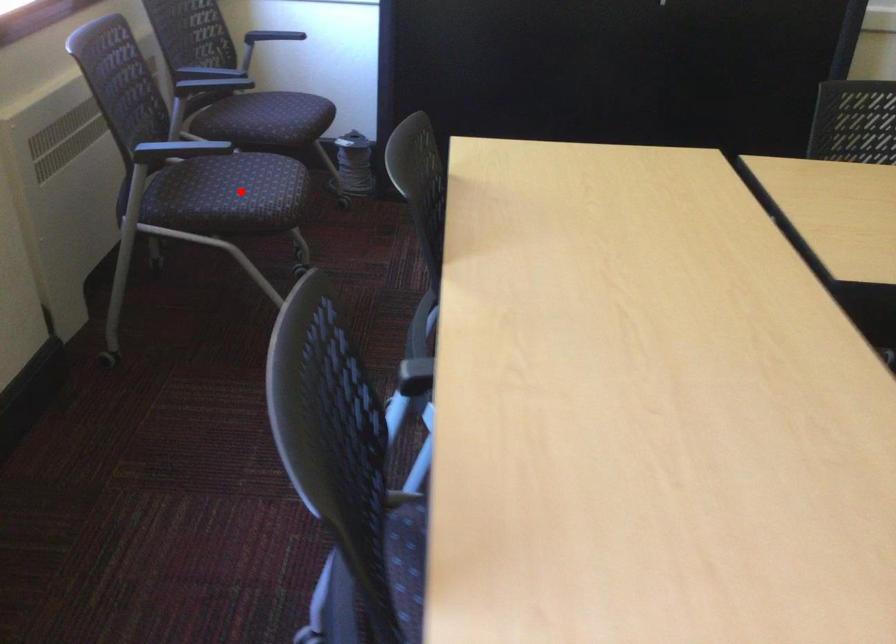
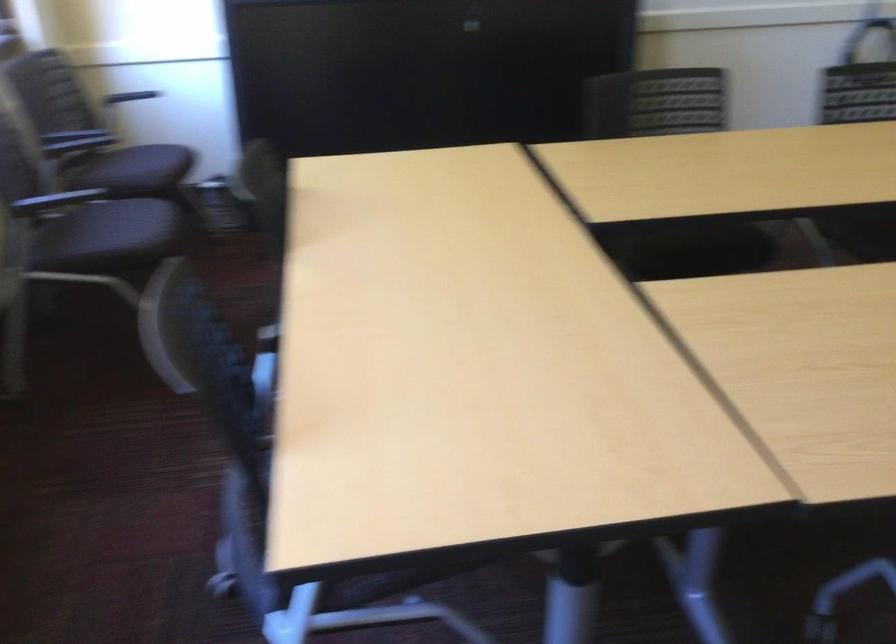
Question: I am providing you with two images of the same scene from different viewpoints. In image1, a red point is highlighted. Considering the same 3D point in image2, which of the following is correct?

Choices:
 (A) It is closer
 (B) It is farther

Answer: (B)